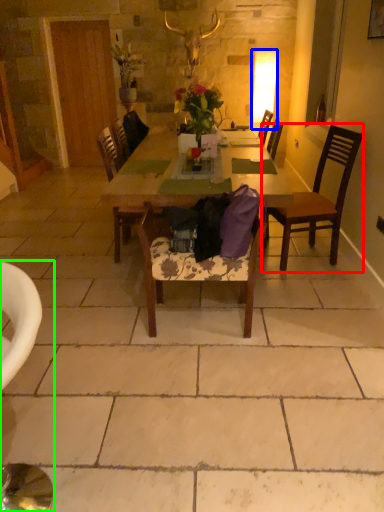
Question: Which object is positioned farthest from chair (highlighted by a red box)? Select from lamp (highlighted by a blue box) and chair (highlighted by a green box).

Choices:
 (A) lamp
 (B) chair

Answer: (A)